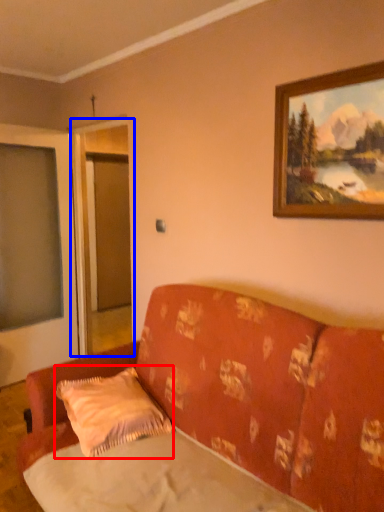
Question: Among these objects, which one is farthest to the camera, pillow (highlighted by a red box) or screen door (highlighted by a blue box)?

Choices:
 (A) pillow
 (B) screen door

Answer: (B)